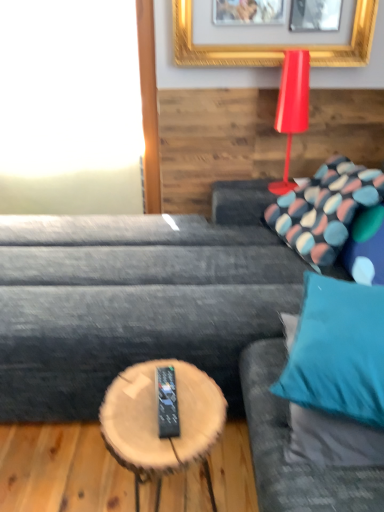
Question: Is teal fabric couch at right next to shiny red table lamp at upper right and touching it?

Choices:
 (A) no
 (B) yes

Answer: (A)

Question: Is teal fabric couch at right not near shiny red table lamp at upper right?

Choices:
 (A) no
 (B) yes

Answer: (B)

Question: From a real-world perspective, is teal fabric couch at right physically above shiny red table lamp at upper right?

Choices:
 (A) no
 (B) yes

Answer: (A)

Question: Is teal fabric couch at right taller than shiny red table lamp at upper right?

Choices:
 (A) no
 (B) yes

Answer: (B)

Question: Is teal fabric couch at right not within shiny red table lamp at upper right?

Choices:
 (A) yes
 (B) no

Answer: (A)

Question: Is teal fabric couch at right positioned behind shiny red table lamp at upper right?

Choices:
 (A) yes
 (B) no

Answer: (B)

Question: From the image's perspective, would you say dark gray fabric couch at center is positioned over white glass window at upper left?

Choices:
 (A) yes
 (B) no

Answer: (B)

Question: Can you confirm if dark gray fabric couch at center is wider than white glass window at upper left?

Choices:
 (A) no
 (B) yes

Answer: (B)

Question: Is dark gray fabric couch at center smaller than white glass window at upper left?

Choices:
 (A) yes
 (B) no

Answer: (B)

Question: Can you confirm if dark gray fabric couch at center is positioned to the right of white glass window at upper left?

Choices:
 (A) no
 (B) yes

Answer: (B)

Question: Are dark gray fabric couch at center and white glass window at upper left far apart?

Choices:
 (A) yes
 (B) no

Answer: (B)

Question: Is dark gray fabric couch at center positioned before white glass window at upper left?

Choices:
 (A) no
 (B) yes

Answer: (B)

Question: Is wooden log coffee table at center shorter than dark gray fabric couch at center?

Choices:
 (A) no
 (B) yes

Answer: (B)